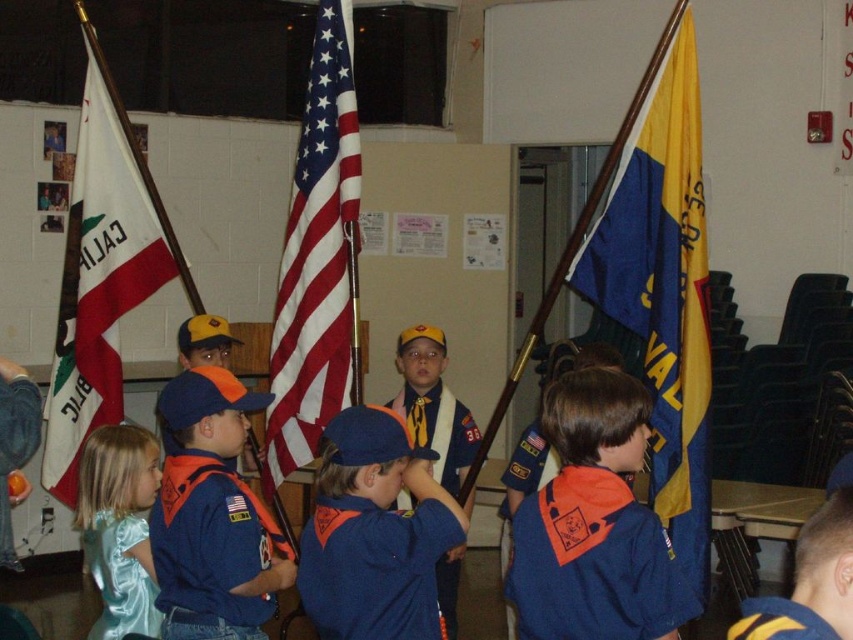
Which of these two, blue cotton shirt at center or blue fabric neckerchief at center, stands shorter?

blue fabric neckerchief at center is shorter.

The height and width of the screenshot is (640, 853). Describe the element at coordinates (592, 563) in the screenshot. I see `blue cotton shirt at center` at that location.

The width and height of the screenshot is (853, 640). What are the coordinates of `blue cotton shirt at center` in the screenshot? It's located at (592, 563).

Who is lower down, american flag at center or blue cotton shirt at center?

blue cotton shirt at center is below.

Does american flag at center appear under blue cotton shirt at center?

No.

Is point (311, 337) closer to viewer compared to point (585, 513)?

No, (311, 337) is behind (585, 513).

At what (x,y) coordinates should I click in order to perform the action: click on american flag at center. Please return your answer as a coordinate pair (x, y). Looking at the image, I should click on (316, 257).

Consider the image. Is american flag at center thinner than blue fleece jacket at center?

Correct, american flag at center's width is less than blue fleece jacket at center's.

Is american flag at center closer to the viewer compared to blue fleece jacket at center?

No.

Locate an element on the screen. The width and height of the screenshot is (853, 640). american flag at center is located at coordinates (316, 257).

Locate an element on the screen. american flag at center is located at coordinates (316, 257).